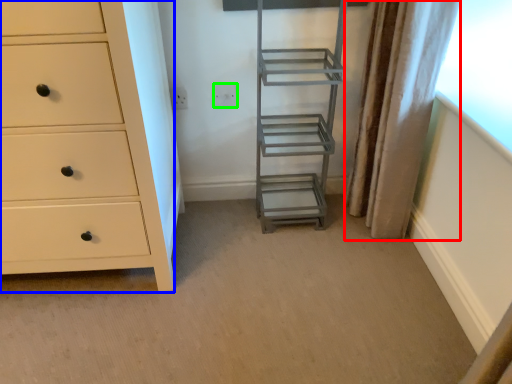
Question: Which object is positioned closest to curtain (highlighted by a red box)? Select from chest of drawers (highlighted by a blue box) and electric outlet (highlighted by a green box).

Choices:
 (A) chest of drawers
 (B) electric outlet

Answer: (B)